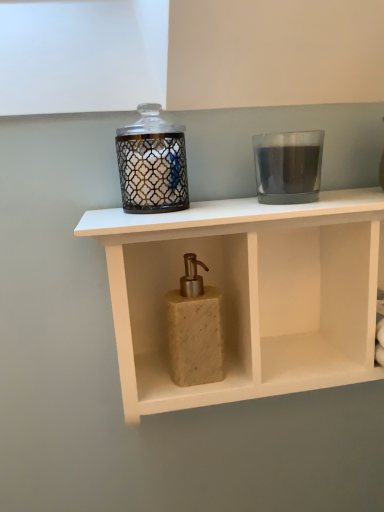
Measure the distance between point (130,177) and camera.

A distance of 22.17 inches exists between point (130,177) and camera.

The width and height of the screenshot is (384, 512). In order to click on matte glass candle holder at upper center, which is counted as the 2th candle holder, starting from the right in this screenshot , I will do `click(152, 164)`.

The width and height of the screenshot is (384, 512). Find the location of `beige stone soap dispenser at center`. beige stone soap dispenser at center is located at coordinates point(195,329).

At what (x,y) coordinates should I click in order to perform the action: click on transparent glass candle at upper right, the second candle holder positioned from the left. Please return your answer as a coordinate pair (x, y). The image size is (384, 512). Looking at the image, I should click on (288, 166).

You are a GUI agent. You are given a task and a screenshot of the screen. Output one action in this format:
    pyautogui.click(x=<x>, y=<y>)
    Task: Click on the matte glass candle holder at upper center, which is counted as the 2th candle holder, starting from the right
    
    Given the screenshot: What is the action you would take?
    pyautogui.click(x=152, y=164)

From the image's perspective, is transparent glass candle at upper right, placed as the 1th candle holder when sorted from right to left, located above or below beige stone soap dispenser at center?

transparent glass candle at upper right, placed as the 1th candle holder when sorted from right to left, is above beige stone soap dispenser at center.

Which of these two, transparent glass candle at upper right, placed as the 1th candle holder when sorted from right to left, or beige stone soap dispenser at center, is smaller?

transparent glass candle at upper right, placed as the 1th candle holder when sorted from right to left, is smaller.

Is transparent glass candle at upper right, the second candle holder positioned from the left, far from beige stone soap dispenser at center?

No.

Between transparent glass candle at upper right, placed as the 1th candle holder when sorted from right to left, and beige stone soap dispenser at center, which one appears on the left side from the viewer's perspective?

From the viewer's perspective, beige stone soap dispenser at center appears more on the left side.

From a real-world perspective, is beige stone soap dispenser at center beneath matte glass candle holder at upper center, which is counted as the 2th candle holder, starting from the right?

Correct, in the physical world, beige stone soap dispenser at center is lower than matte glass candle holder at upper center, which is counted as the 2th candle holder, starting from the right.

Which is less distant, [349,249] or [125,164]?

The point [125,164] is more forward.

Considering the relative sizes of beige stone soap dispenser at center and matte glass candle holder at upper center, which is the first candle holder in left-to-right order, in the image provided, is beige stone soap dispenser at center smaller than matte glass candle holder at upper center, which is the first candle holder in left-to-right order,?

Incorrect, beige stone soap dispenser at center is not smaller in size than matte glass candle holder at upper center, which is the first candle holder in left-to-right order.

From the image's perspective, which is below, transparent glass candle at upper right, placed as the 1th candle holder when sorted from right to left, or beige stone soap dispenser at center?

beige stone soap dispenser at center.

Is transparent glass candle at upper right, the second candle holder positioned from the left, aimed at beige stone soap dispenser at center?

No, transparent glass candle at upper right, the second candle holder positioned from the left, is not aimed at beige stone soap dispenser at center.

Find the location of `soap dispenser behind the transparent glass candle at upper right, the second candle holder positioned from the left`. soap dispenser behind the transparent glass candle at upper right, the second candle holder positioned from the left is located at coordinates [195, 329].

Considering the relative sizes of transparent glass candle at upper right, placed as the 1th candle holder when sorted from right to left, and beige stone soap dispenser at center in the image provided, is transparent glass candle at upper right, placed as the 1th candle holder when sorted from right to left, thinner than beige stone soap dispenser at center?

No.

From the image's perspective, is matte glass candle holder at upper center, which is counted as the 2th candle holder, starting from the right, above or below beige stone soap dispenser at center?

matte glass candle holder at upper center, which is counted as the 2th candle holder, starting from the right, is above beige stone soap dispenser at center.

Considering the relative sizes of matte glass candle holder at upper center, which is counted as the 2th candle holder, starting from the right, and beige stone soap dispenser at center in the image provided, is matte glass candle holder at upper center, which is counted as the 2th candle holder, starting from the right, wider than beige stone soap dispenser at center?

Yes.

Is matte glass candle holder at upper center, which is counted as the 2th candle holder, starting from the right, behind beige stone soap dispenser at center?

No.

Is matte glass candle holder at upper center, which is counted as the 2th candle holder, starting from the right, oriented away from beige stone soap dispenser at center?

No, matte glass candle holder at upper center, which is counted as the 2th candle holder, starting from the right,'s orientation is not away from beige stone soap dispenser at center.

In terms of height, does matte glass candle holder at upper center, which is the first candle holder in left-to-right order, look taller or shorter compared to beige stone soap dispenser at center?

Clearly, matte glass candle holder at upper center, which is the first candle holder in left-to-right order, is shorter compared to beige stone soap dispenser at center.

Considering the sizes of matte glass candle holder at upper center, which is the first candle holder in left-to-right order, and beige stone soap dispenser at center in the image, is matte glass candle holder at upper center, which is the first candle holder in left-to-right order, wider or thinner than beige stone soap dispenser at center?

Considering their sizes, matte glass candle holder at upper center, which is the first candle holder in left-to-right order, looks slimmer than beige stone soap dispenser at center.

Between matte glass candle holder at upper center, which is the first candle holder in left-to-right order, and beige stone soap dispenser at center, which one has larger size?

Bigger between the two is beige stone soap dispenser at center.

Is beige stone soap dispenser at center located outside matte glass candle holder at upper center, which is counted as the 2th candle holder, starting from the right?

beige stone soap dispenser at center is positioned outside matte glass candle holder at upper center, which is counted as the 2th candle holder, starting from the right.

Between beige stone soap dispenser at center and matte glass candle holder at upper center, which is the first candle holder in left-to-right order, which one is positioned behind?

beige stone soap dispenser at center is further from the camera.

Who is smaller, beige stone soap dispenser at center or matte glass candle holder at upper center, which is the first candle holder in left-to-right order?

matte glass candle holder at upper center, which is the first candle holder in left-to-right order, is smaller.

From a real-world perspective, is beige stone soap dispenser at center located higher than matte glass candle holder at upper center, which is the first candle holder in left-to-right order?

No, from a real-world perspective, beige stone soap dispenser at center is not above matte glass candle holder at upper center, which is the first candle holder in left-to-right order.

Which object is positioned more to the left, transparent glass candle at upper right, placed as the 1th candle holder when sorted from right to left, or matte glass candle holder at upper center, which is the first candle holder in left-to-right order?

Positioned to the left is matte glass candle holder at upper center, which is the first candle holder in left-to-right order.

Considering the positions of points (284, 178) and (180, 207), is point (284, 178) farther from camera compared to point (180, 207)?

That is False.

Locate an element on the screen. candle holder that appears in front of the transparent glass candle at upper right, placed as the 1th candle holder when sorted from right to left is located at coordinates (152, 164).

From a real-world perspective, who is located lower, transparent glass candle at upper right, placed as the 1th candle holder when sorted from right to left, or matte glass candle holder at upper center, which is counted as the 2th candle holder, starting from the right?

In real-world perspective, transparent glass candle at upper right, placed as the 1th candle holder when sorted from right to left, is lower.

This screenshot has height=512, width=384. I want to click on shelf located on the left of transparent glass candle at upper right, the second candle holder positioned from the left, so click(248, 294).

This screenshot has width=384, height=512. I want to click on candle holder that is the 1st one when counting backward from the beige stone soap dispenser at center, so click(152, 164).

Based on their spatial positions, is beige stone soap dispenser at center or beige stone soap dispenser at center closer to transparent glass candle at upper right, placed as the 1th candle holder when sorted from right to left?

beige stone soap dispenser at center lies closer to transparent glass candle at upper right, placed as the 1th candle holder when sorted from right to left, than the other object.

Based on their spatial positions, is beige stone soap dispenser at center or matte glass candle holder at upper center, which is the first candle holder in left-to-right order, further from transparent glass candle at upper right, placed as the 1th candle holder when sorted from right to left?

beige stone soap dispenser at center lies further to transparent glass candle at upper right, placed as the 1th candle holder when sorted from right to left, than the other object.

Estimate the real-world distances between objects in this image. Which object is closer to beige stone soap dispenser at center, beige stone soap dispenser at center or matte glass candle holder at upper center, which is the first candle holder in left-to-right order?

beige stone soap dispenser at center.

When comparing their distances from beige stone soap dispenser at center, does transparent glass candle at upper right, placed as the 1th candle holder when sorted from right to left, or matte glass candle holder at upper center, which is counted as the 2th candle holder, starting from the right, seem further?

Among the two, matte glass candle holder at upper center, which is counted as the 2th candle holder, starting from the right, is located further to beige stone soap dispenser at center.

Based on the photo, looking at the image, which one is located closer to beige stone soap dispenser at center, beige stone soap dispenser at center or transparent glass candle at upper right, placed as the 1th candle holder when sorted from right to left?

beige stone soap dispenser at center is closer to beige stone soap dispenser at center.

Based on their spatial positions, is beige stone soap dispenser at center or transparent glass candle at upper right, placed as the 1th candle holder when sorted from right to left, closer to matte glass candle holder at upper center, which is counted as the 2th candle holder, starting from the right?

transparent glass candle at upper right, placed as the 1th candle holder when sorted from right to left, lies closer to matte glass candle holder at upper center, which is counted as the 2th candle holder, starting from the right, than the other object.

Which object lies nearer to the anchor point transparent glass candle at upper right, the second candle holder positioned from the left, beige stone soap dispenser at center or beige stone soap dispenser at center?

Among the two, beige stone soap dispenser at center is located nearer to transparent glass candle at upper right, the second candle holder positioned from the left.

Estimate the real-world distances between objects in this image. Which object is closer to beige stone soap dispenser at center, transparent glass candle at upper right, the second candle holder positioned from the left, or beige stone soap dispenser at center?

beige stone soap dispenser at center lies closer to beige stone soap dispenser at center than the other object.

At what (x,y) coordinates should I click in order to perform the action: click on soap dispenser between matte glass candle holder at upper center, which is the first candle holder in left-to-right order, and beige stone soap dispenser at center vertically. Please return your answer as a coordinate pair (x, y). The image size is (384, 512). Looking at the image, I should click on point(195,329).

At what (x,y) coordinates should I click in order to perform the action: click on candle holder between transparent glass candle at upper right, placed as the 1th candle holder when sorted from right to left, and beige stone soap dispenser at center in the up-down direction. Please return your answer as a coordinate pair (x, y). Looking at the image, I should click on (152, 164).

Image resolution: width=384 pixels, height=512 pixels. I want to click on soap dispenser between transparent glass candle at upper right, placed as the 1th candle holder when sorted from right to left, and beige stone soap dispenser at center, in the vertical direction, so click(x=195, y=329).

Where is `candle holder between transparent glass candle at upper right, placed as the 1th candle holder when sorted from right to left, and beige stone soap dispenser at center vertically`? This screenshot has height=512, width=384. candle holder between transparent glass candle at upper right, placed as the 1th candle holder when sorted from right to left, and beige stone soap dispenser at center vertically is located at coordinates (152, 164).